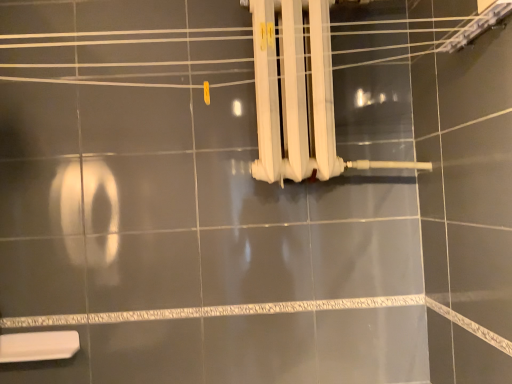
Describe the element at coordinates (38, 346) in the screenshot. I see `white plastic toilet at lower left` at that location.

Identify the location of white plastic toilet at lower left. The height and width of the screenshot is (384, 512). (38, 346).

Measure the distance between point (321,31) and camera.

Point (321,31) is 3.89 feet from camera.

The height and width of the screenshot is (384, 512). Describe the element at coordinates (298, 95) in the screenshot. I see `white plastic radiator at upper right` at that location.

Where is `white plastic radiator at upper right`? The image size is (512, 384). white plastic radiator at upper right is located at coordinates 298,95.

Find the location of `white plastic toilet at lower left`. white plastic toilet at lower left is located at coordinates (38, 346).

Which is more to the right, white plastic radiator at upper right or white plastic toilet at lower left?

white plastic radiator at upper right is more to the right.

Is white plastic radiator at upper right further to the viewer compared to white plastic toilet at lower left?

No, the depth of white plastic radiator at upper right is less than that of white plastic toilet at lower left.

Between point (255, 167) and point (21, 350), which one is positioned in front?

Point (255, 167)

From the image's perspective, is white plastic radiator at upper right below white plastic toilet at lower left?

No, from the image's perspective, white plastic radiator at upper right is not below white plastic toilet at lower left.

Based on the photo, from a real-world perspective, relative to white plastic toilet at lower left, is white plastic radiator at upper right vertically above or below?

white plastic radiator at upper right is situated higher than white plastic toilet at lower left in the real world.

Which of these two, white plastic radiator at upper right or white plastic toilet at lower left, is wider?

Wider between the two is white plastic radiator at upper right.

Does white plastic radiator at upper right have a lesser height compared to white plastic toilet at lower left?

No.

Who is smaller, white plastic radiator at upper right or white plastic toilet at lower left?

Smaller between the two is white plastic toilet at lower left.

Is white plastic radiator at upper right outside of white plastic toilet at lower left?

Absolutely, white plastic radiator at upper right is external to white plastic toilet at lower left.

In the scene shown: Is white plastic radiator at upper right directly adjacent to white plastic toilet at lower left?

No, white plastic radiator at upper right is not beside white plastic toilet at lower left.

Is white plastic radiator at upper right facing away from white plastic toilet at lower left?

No, white plastic radiator at upper right's orientation is not away from white plastic toilet at lower left.

How much distance is there between white plastic radiator at upper right and white plastic toilet at lower left?

The distance of white plastic radiator at upper right from white plastic toilet at lower left is 1.01 meters.

Where is `shower on the right of the white plastic toilet at lower left`? This screenshot has height=384, width=512. shower on the right of the white plastic toilet at lower left is located at coordinates (298, 95).

Does white plastic toilet at lower left appear on the left side of white plastic radiator at upper right?

Correct, you'll find white plastic toilet at lower left to the left of white plastic radiator at upper right.

Between white plastic toilet at lower left and white plastic radiator at upper right, which one is positioned in front?

white plastic radiator at upper right.

Which is less distant, (17,358) or (349,161)?

Point (17,358).

From the image's perspective, between white plastic toilet at lower left and white plastic radiator at upper right, who is located below?

From the image's view, white plastic toilet at lower left is below.

From a real-world perspective, which is physically above, white plastic toilet at lower left or white plastic radiator at upper right?

white plastic radiator at upper right is physically above.

Which of these two, white plastic toilet at lower left or white plastic radiator at upper right, is wider?

white plastic radiator at upper right is wider.

Who is shorter, white plastic toilet at lower left or white plastic radiator at upper right?

With less height is white plastic toilet at lower left.

Considering the sizes of white plastic toilet at lower left and white plastic radiator at upper right in the image, is white plastic toilet at lower left bigger or smaller than white plastic radiator at upper right?

Considering their sizes, white plastic toilet at lower left takes up less space than white plastic radiator at upper right.

Can we say white plastic toilet at lower left lies outside white plastic radiator at upper right?

That's correct, white plastic toilet at lower left is outside of white plastic radiator at upper right.

Is white plastic toilet at lower left next to white plastic radiator at upper right and touching it?

No, white plastic toilet at lower left is not next to white plastic radiator at upper right.

Could you tell me if white plastic toilet at lower left is facing white plastic radiator at upper right?

No, white plastic toilet at lower left is not oriented towards white plastic radiator at upper right.

What's the angular difference between white plastic toilet at lower left and white plastic radiator at upper right's facing directions?

white plastic toilet at lower left and white plastic radiator at upper right are facing 0.404 degrees away from each other.

Measure the distance between white plastic toilet at lower left and white plastic radiator at upper right.

white plastic toilet at lower left is 3.32 feet from white plastic radiator at upper right.

I want to click on toilet on the left of white plastic radiator at upper right, so click(x=38, y=346).

Find the location of `shower in front of the white plastic toilet at lower left`. shower in front of the white plastic toilet at lower left is located at coordinates (298, 95).

You are a GUI agent. You are given a task and a screenshot of the screen. Output one action in this format:
    pyautogui.click(x=<x>, y=<y>)
    Task: Click on the shower on the right of white plastic toilet at lower left
    The width and height of the screenshot is (512, 384).
    Given the screenshot: What is the action you would take?
    pyautogui.click(x=298, y=95)